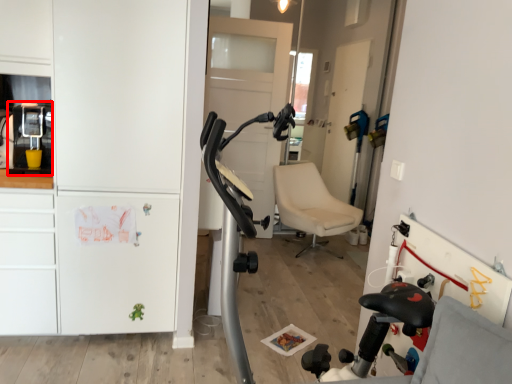
Question: From the image's perspective, where is appliance (annotated by the red box) located in relation to dresser in the image?

Choices:
 (A) below
 (B) above

Answer: (B)